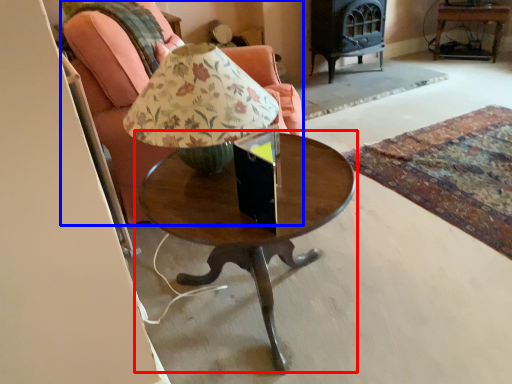
Question: Which object is closer to the camera taking this photo, coffee table (highlighted by a red box) or chair (highlighted by a blue box)?

Choices:
 (A) coffee table
 (B) chair

Answer: (A)